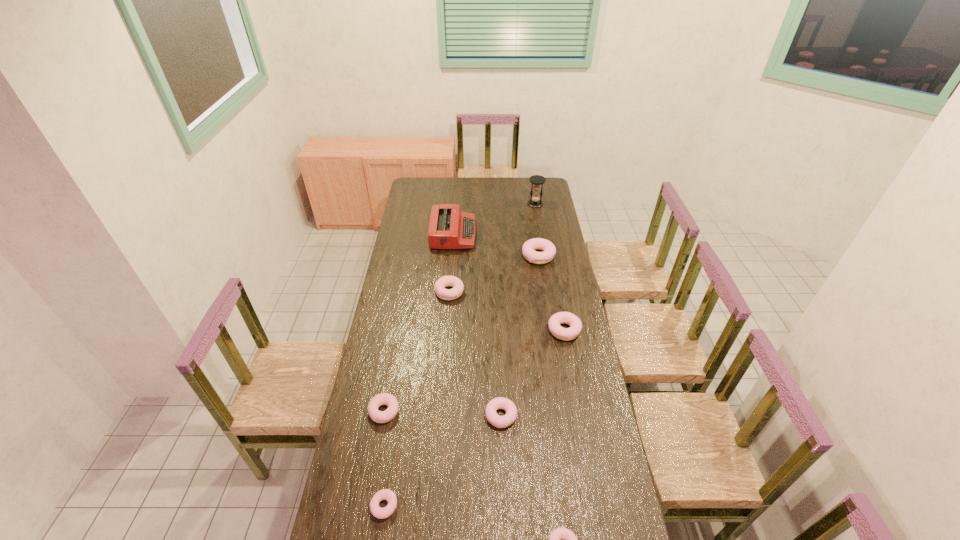
What are the coordinates of `pink doughnut that is the fourth nearest to the eighth shortest object` in the screenshot? It's located at (569, 539).

Find the location of `the closest pink doughnut to the fifth nearest object`. the closest pink doughnut to the fifth nearest object is located at coordinates (503, 403).

The width and height of the screenshot is (960, 540). What are the coordinates of `purple doughnut that can be found as the second closest to the farthest doughnut` in the screenshot? It's located at (387, 399).

Identify which purple doughnut is located as the nearest to the biggest pink doughnut. Please provide its 2D coordinates. Your answer should be formatted as a tuple, i.e. [(x, y)], where the tuple contains the x and y coordinates of a point satisfying the conditions above.

[(445, 281)]

You are a GUI agent. You are given a task and a screenshot of the screen. Output one action in this format:
    pyautogui.click(x=<x>, y=<y>)
    Task: Click on the free point that satisfies the following two spatial constraints: 1. on the typing side of the eighth shortest object; 2. on the back side of the third doughnut from left to right
    This screenshot has height=540, width=960.
    Given the screenshot: What is the action you would take?
    [x=448, y=292]

You are a GUI agent. You are given a task and a screenshot of the screen. Output one action in this format:
    pyautogui.click(x=<x>, y=<y>)
    Task: Click on the free space that satisfies the following two spatial constraints: 1. on the front side of the biggest pink doughnut; 2. on the left side of the second biggest pink doughnut
    This screenshot has width=960, height=540.
    Given the screenshot: What is the action you would take?
    pyautogui.click(x=550, y=330)

I want to click on free point that satisfies the following two spatial constraints: 1. on the typing side of the typewriter; 2. on the back side of the fifth doughnut from right to left, so click(x=448, y=292).